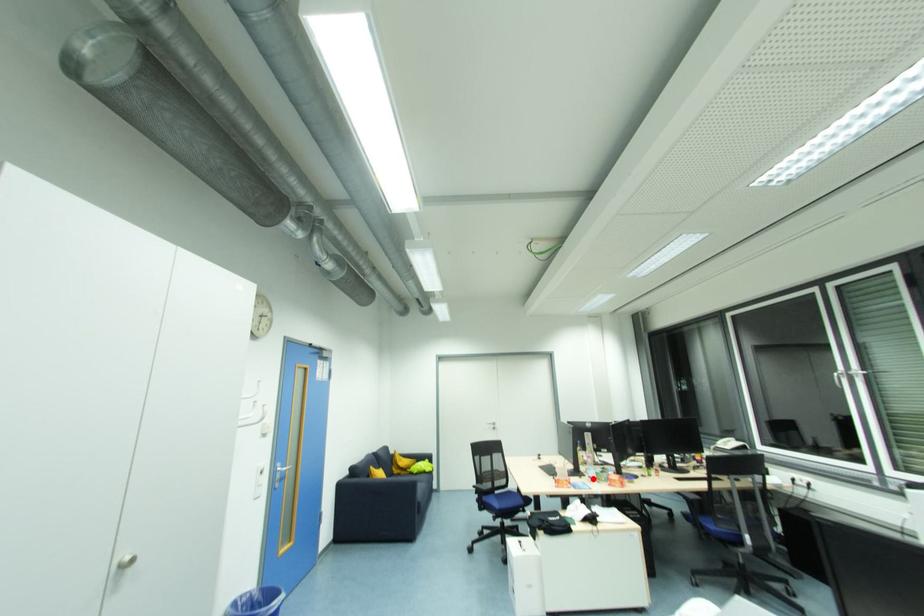
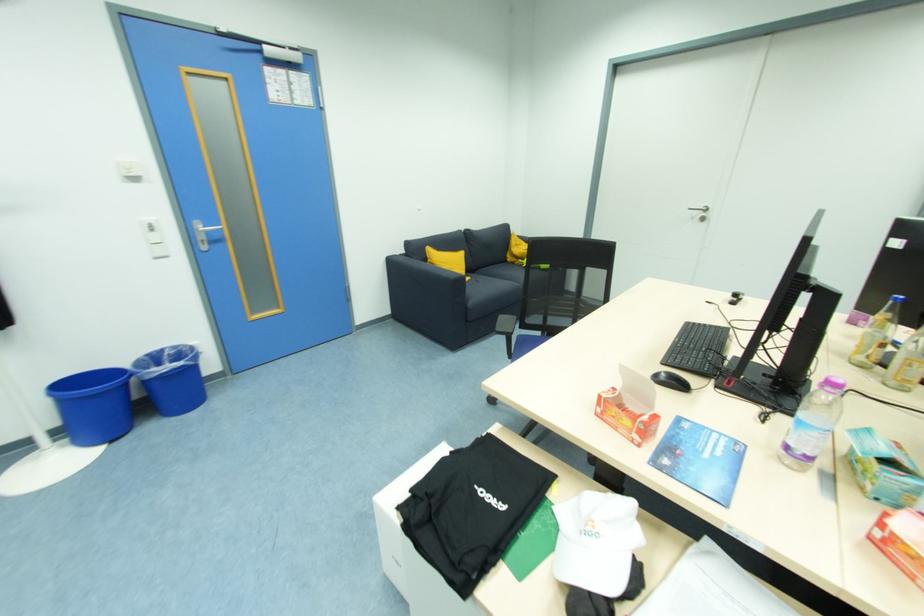
Find the pixel in the second image that matches the highlighted location in the first image.

(792, 448)